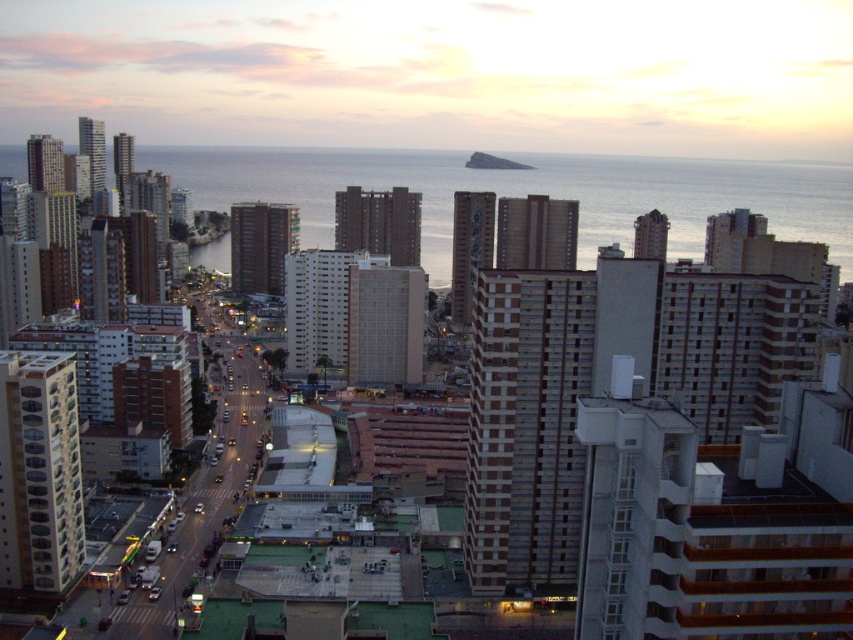
Does matte brown building at center have a greater width compared to blue water at left?

Yes, matte brown building at center is wider than blue water at left.

Does point (306, 16) come closer to viewer compared to point (310, 193)?

No.

Where is `matte brown building at center`? The image size is (853, 640). matte brown building at center is located at coordinates (439, 74).